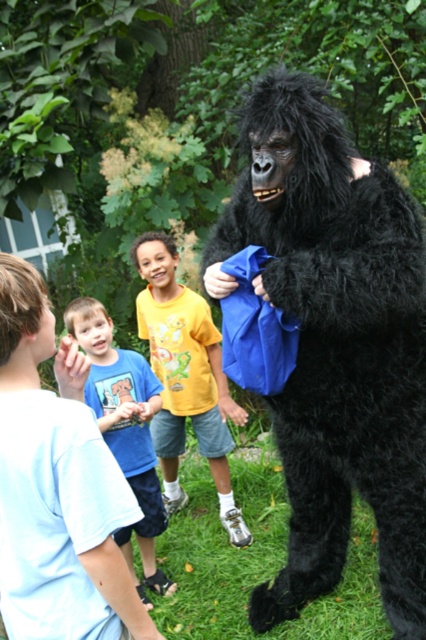
Question: Among these objects, which one is farthest from the camera?

Choices:
 (A) yellow t-shirt at center
 (B) black furry gorilla at right

Answer: (A)

Question: Which object is positioned closest to the yellow t-shirt at center?

Choices:
 (A) blue cotton shirt at center
 (B) black furry gorilla at right

Answer: (A)

Question: Can you confirm if yellow t-shirt at center is positioned to the right of blue cotton shirt at center?

Choices:
 (A) yes
 (B) no

Answer: (A)

Question: Considering the real-world distances, which object is farthest from the blue cotton shirt at center?

Choices:
 (A) yellow t-shirt at center
 (B) black furry gorilla at right

Answer: (B)

Question: Can you confirm if black furry gorilla at right is positioned to the left of yellow t-shirt at center?

Choices:
 (A) yes
 (B) no

Answer: (B)

Question: Is black furry gorilla at right thinner than yellow t-shirt at center?

Choices:
 (A) yes
 (B) no

Answer: (B)